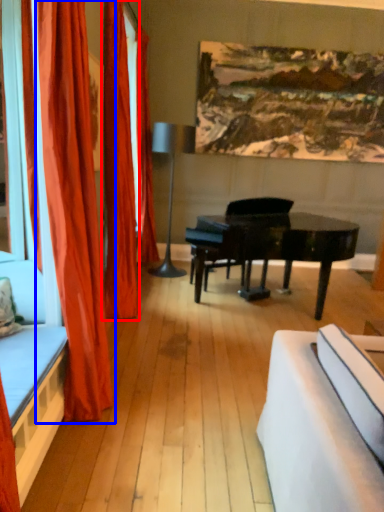
Question: Which object appears farthest to the camera in this image, curtain (highlighted by a red box) or curtain (highlighted by a blue box)?

Choices:
 (A) curtain
 (B) curtain

Answer: (A)